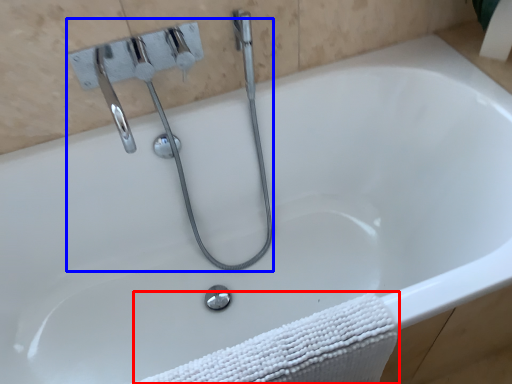
Question: Which object is further to the camera taking this photo, bath towel (highlighted by a red box) or plumbing fixture (highlighted by a blue box)?

Choices:
 (A) bath towel
 (B) plumbing fixture

Answer: (B)